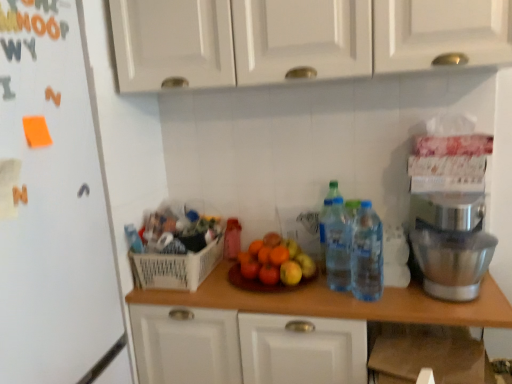
Identify the location of free space to the right of translucent plastic bottles at center right. This screenshot has height=384, width=512. (419, 300).